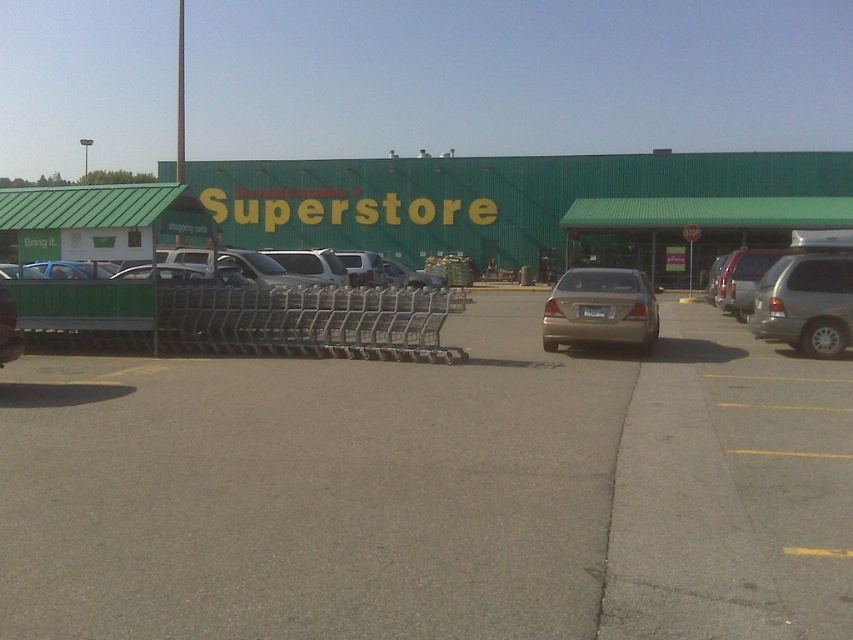
Question: Is green matte superstore at center closer to camera compared to matte white van at center?

Choices:
 (A) no
 (B) yes

Answer: (A)

Question: Where is satin silver suv at right located in relation to matte white van at center in the image?

Choices:
 (A) above
 (B) below

Answer: (B)

Question: Is green matte superstore at center below matte silver suv at center?

Choices:
 (A) yes
 (B) no

Answer: (B)

Question: Which object is positioned farthest from the metallic silver shopping carts at center?

Choices:
 (A) satin silver suv at right
 (B) gold matte sedan at center
 (C) green matte superstore at center
 (D) matte white van at center

Answer: (C)

Question: Estimate the real-world distances between objects in this image. Which object is closer to the satin silver suv at right?

Choices:
 (A) matte silver sedan at center
 (B) gold matte sedan at center

Answer: (B)

Question: Which point appears farthest from the camera in this image?

Choices:
 (A) (366, 218)
 (B) (659, 387)
 (C) (590, 332)
 (D) (268, 273)

Answer: (A)